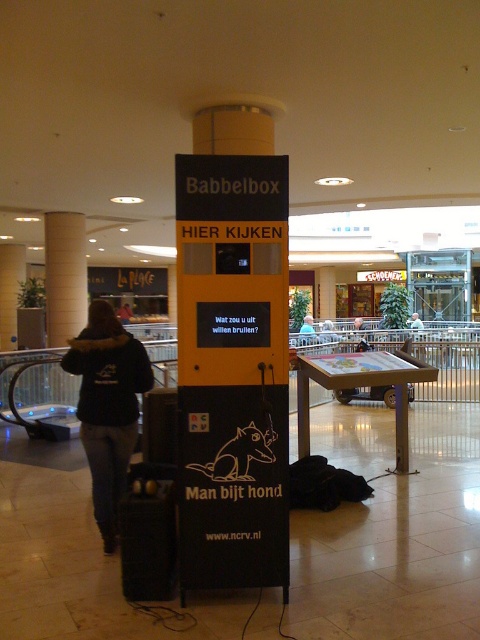
Question: Is yellow matte babbelbox at center further to camera compared to white glossy pillar at upper left?

Choices:
 (A) no
 (B) yes

Answer: (A)

Question: Does yellow matte babbelbox at center appear under white glossy pillar at upper left?

Choices:
 (A) no
 (B) yes

Answer: (B)

Question: Does black fleece jacket at left have a larger size compared to blue denim jacket at center?

Choices:
 (A) no
 (B) yes

Answer: (A)

Question: Among these objects, which one is nearest to the camera?

Choices:
 (A) yellow matte babbelbox at center
 (B) black fleece jacket at left
 (C) blue denim jacket at center
 (D) white glossy pillar at upper left

Answer: (A)

Question: Which of the following is the farthest from the observer?

Choices:
 (A) black fleece jacket at left
 (B) yellow matte babbelbox at center
 (C) blue denim jacket at center
 (D) white glossy pillar at upper left

Answer: (C)

Question: Which object is positioned farthest from the yellow matte babbelbox at center?

Choices:
 (A) blue denim jacket at center
 (B) white glossy pillar at upper left

Answer: (A)